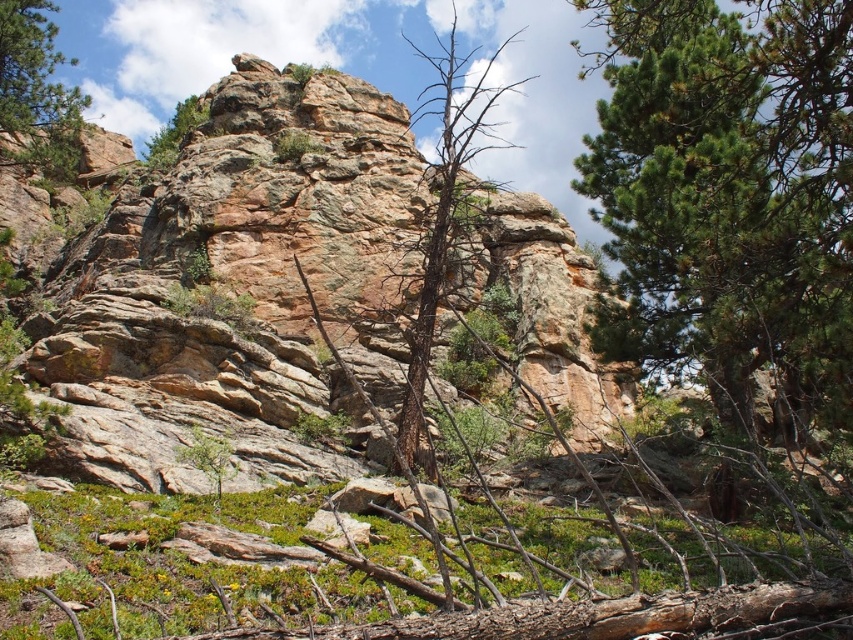
Is brown rough tree at center further to the viewer compared to green pine tree at upper left?

No, it is in front of green pine tree at upper left.

I want to click on brown rough tree at center, so click(x=444, y=204).

At what (x,y) coordinates should I click in order to perform the action: click on brown rough tree at center. Please return your answer as a coordinate pair (x, y). Looking at the image, I should click on (444, 204).

Does rustic stone cliff at center appear on the left side of green textured tree at center?

Yes, rustic stone cliff at center is to the left of green textured tree at center.

Is rustic stone cliff at center taller than green textured tree at center?

No.

Who is more distant from viewer, (360, 195) or (706, 84)?

Positioned behind is point (360, 195).

In order to click on rustic stone cliff at center in this screenshot , I will do `click(241, 288)`.

Is green pine tree at upper left closer to camera compared to green textured tree at upper center?

Yes, it is.

Is point (62, 145) closer to viewer compared to point (157, 154)?

Yes, it is in front of point (157, 154).

The width and height of the screenshot is (853, 640). Find the location of `green pine tree at upper left`. green pine tree at upper left is located at coordinates (36, 90).